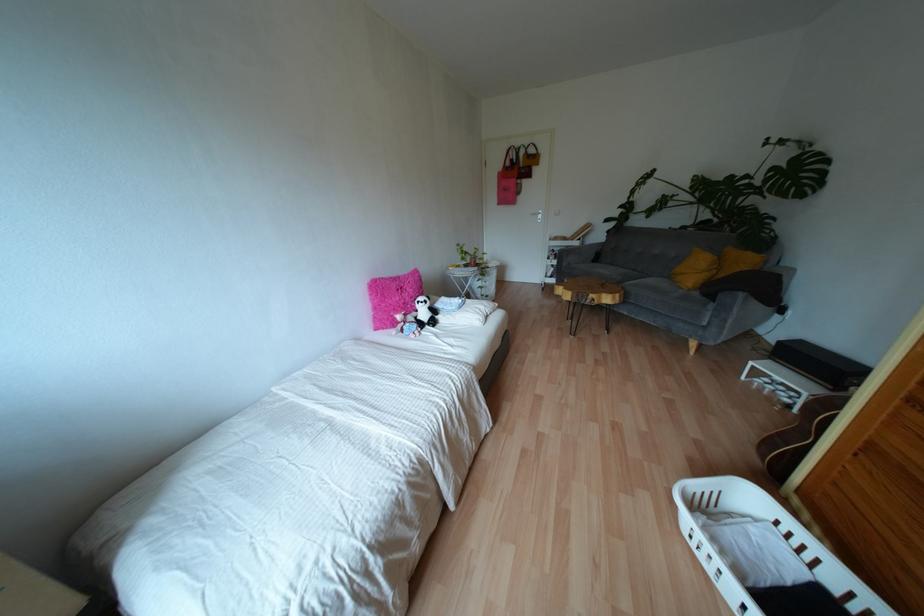
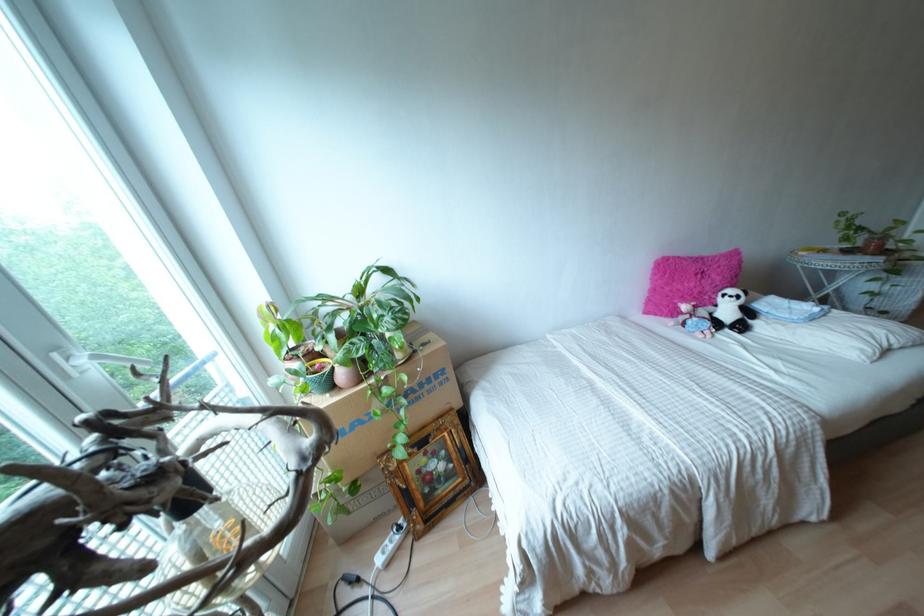
Locate, in the second image, the point that corresponds to point (432, 310) in the first image.

(747, 312)